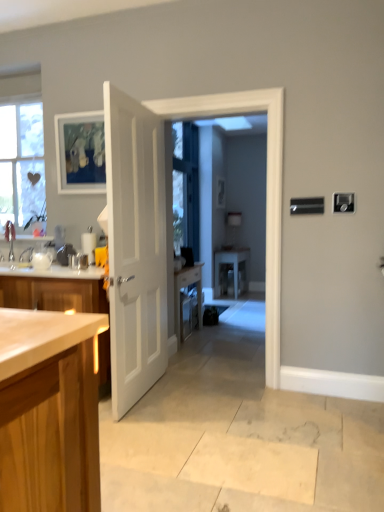
Question: Considering the relative sizes of white glossy door at center and clear glass window screen at center in the image provided, is white glossy door at center taller than clear glass window screen at center?

Choices:
 (A) no
 (B) yes

Answer: (B)

Question: Would you say white glossy door at center is a long distance from clear glass window screen at center?

Choices:
 (A) yes
 (B) no

Answer: (A)

Question: Considering the relative sizes of white glossy door at center and clear glass window screen at center in the image provided, is white glossy door at center bigger than clear glass window screen at center?

Choices:
 (A) no
 (B) yes

Answer: (A)

Question: Is clear glass window screen at center completely or partially inside white glossy door at center?

Choices:
 (A) yes
 (B) no

Answer: (B)

Question: Considering the relative sizes of white glossy door at center and clear glass window screen at center in the image provided, is white glossy door at center wider than clear glass window screen at center?

Choices:
 (A) no
 (B) yes

Answer: (B)

Question: Could you tell me if white glossy door at center is facing clear glass window screen at center?

Choices:
 (A) yes
 (B) no

Answer: (B)

Question: Considering the relative sizes of white matte door at center and clear glass window screen at center in the image provided, is white matte door at center smaller than clear glass window screen at center?

Choices:
 (A) no
 (B) yes

Answer: (B)

Question: From the image's perspective, is white matte door at center located above clear glass window screen at center?

Choices:
 (A) no
 (B) yes

Answer: (A)

Question: Does white matte door at center appear on the right side of clear glass window screen at center?

Choices:
 (A) no
 (B) yes

Answer: (A)

Question: Does white matte door at center have a greater width compared to clear glass window screen at center?

Choices:
 (A) yes
 (B) no

Answer: (B)

Question: Does white matte door at center turn towards clear glass window screen at center?

Choices:
 (A) no
 (B) yes

Answer: (A)

Question: Is white matte door at center not inside clear glass window screen at center?

Choices:
 (A) yes
 (B) no

Answer: (A)

Question: Is matte wooden picture frame at upper left outside of white glossy door at center?

Choices:
 (A) no
 (B) yes

Answer: (B)